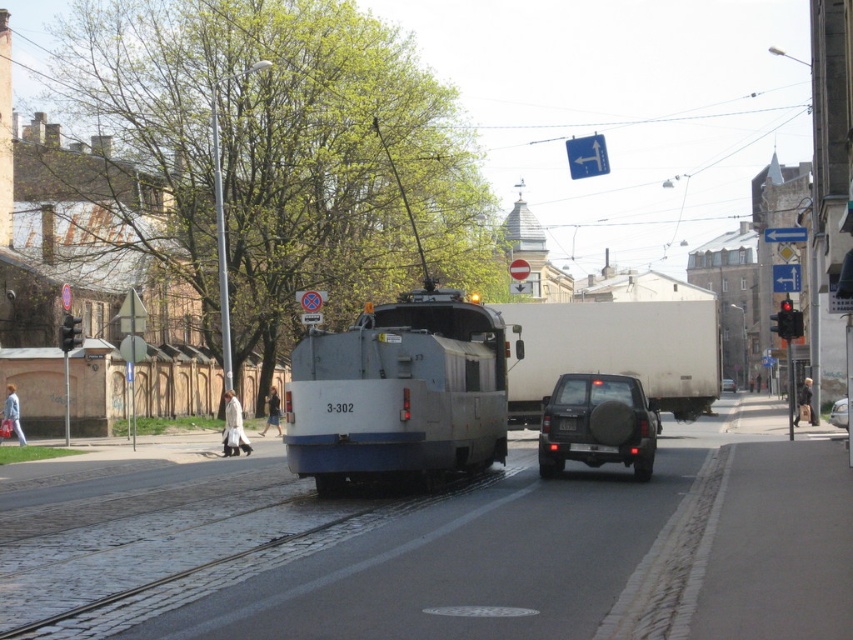
Can you confirm if white matte truck at center is smaller than metallic silver suv at center?

Indeed, white matte truck at center has a smaller size compared to metallic silver suv at center.

Is white matte truck at center to the right of metallic silver suv at center from the viewer's perspective?

In fact, white matte truck at center is to the left of metallic silver suv at center.

Does point (525, 323) come behind point (727, 378)?

That is False.

You are a GUI agent. You are given a task and a screenshot of the screen. Output one action in this format:
    pyautogui.click(x=<x>, y=<y>)
    Task: Click on the white matte truck at center
    The width and height of the screenshot is (853, 640).
    Given the screenshot: What is the action you would take?
    pyautogui.click(x=614, y=352)

Is point (498, 404) closer to camera compared to point (727, 380)?

Yes, it is.

Is white matte garbage truck at center in front of metallic silver suv at center?

Yes, white matte garbage truck at center is closer to the viewer.

I want to click on white matte garbage truck at center, so click(x=399, y=392).

Can you confirm if dark gray matte suv at center is thinner than metallic silver suv at center?

Correct, dark gray matte suv at center's width is less than metallic silver suv at center's.

Who is taller, dark gray matte suv at center or metallic silver suv at center?

Standing taller between the two is metallic silver suv at center.

This screenshot has width=853, height=640. Identify the location of dark gray matte suv at center. (596, 424).